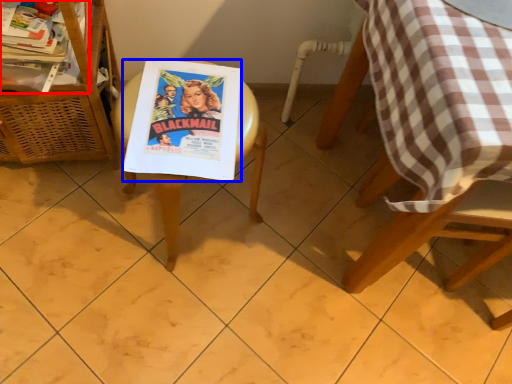
Question: Which object appears closest to the camera in this image, magazine (highlighted by a red box) or comic book (highlighted by a blue box)?

Choices:
 (A) magazine
 (B) comic book

Answer: (B)